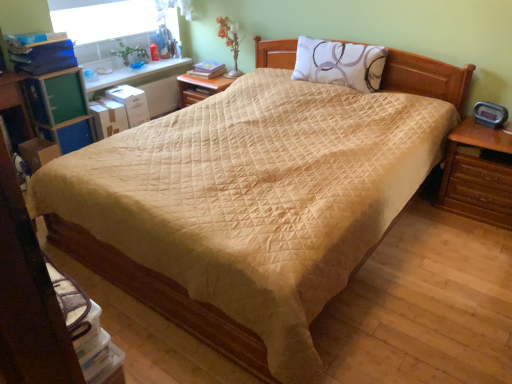
Question: Is matte yellow book at center further to the viewer compared to white printed pillow at upper center?

Choices:
 (A) no
 (B) yes

Answer: (B)

Question: From the image's perspective, is matte yellow book at center located above white printed pillow at upper center?

Choices:
 (A) yes
 (B) no

Answer: (A)

Question: From a real-world perspective, is matte yellow book at center on top of white printed pillow at upper center?

Choices:
 (A) no
 (B) yes

Answer: (A)

Question: Is matte yellow book at center taller than white printed pillow at upper center?

Choices:
 (A) yes
 (B) no

Answer: (B)

Question: Is white printed pillow at upper center located within matte yellow book at center?

Choices:
 (A) no
 (B) yes

Answer: (A)

Question: Is matte yellow book at center to the right of white printed pillow at upper center from the viewer's perspective?

Choices:
 (A) yes
 (B) no

Answer: (B)

Question: Could you tell me if matte yellow book at center is facing white plastic window screen at upper left?

Choices:
 (A) no
 (B) yes

Answer: (A)

Question: From the image's perspective, would you say matte yellow book at center is shown under white plastic window screen at upper left?

Choices:
 (A) yes
 (B) no

Answer: (A)

Question: Considering the relative sizes of matte yellow book at center and white plastic window screen at upper left in the image provided, is matte yellow book at center wider than white plastic window screen at upper left?

Choices:
 (A) yes
 (B) no

Answer: (A)

Question: Does matte yellow book at center appear on the left side of white plastic window screen at upper left?

Choices:
 (A) no
 (B) yes

Answer: (A)

Question: Is there a large distance between matte yellow book at center and white plastic window screen at upper left?

Choices:
 (A) no
 (B) yes

Answer: (A)

Question: Is matte yellow book at center closer to camera compared to white plastic window screen at upper left?

Choices:
 (A) yes
 (B) no

Answer: (B)

Question: Are white printed pillow at upper center and white plastic window screen at upper left beside each other?

Choices:
 (A) yes
 (B) no

Answer: (B)